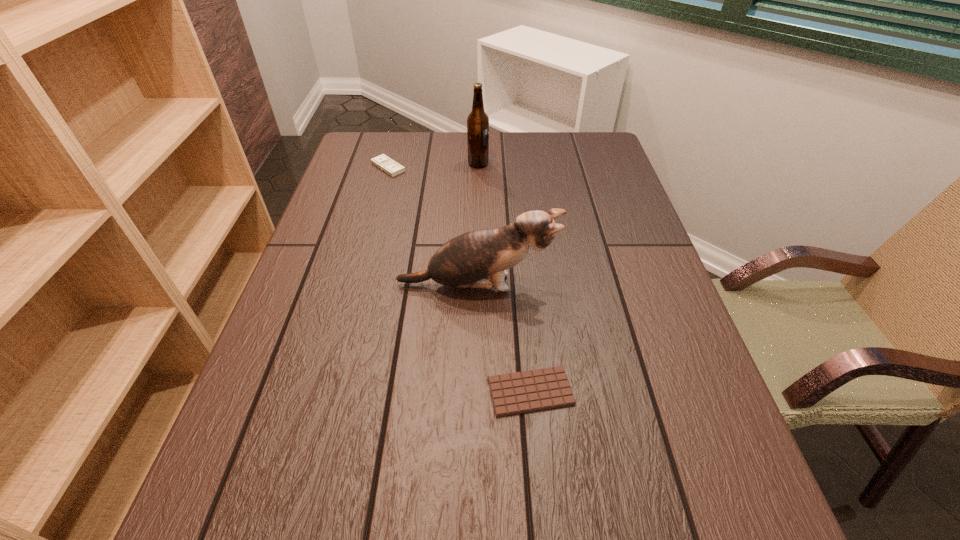
The height and width of the screenshot is (540, 960). Identify the location of free spot between the money and the third shortest object. (433, 226).

This screenshot has width=960, height=540. What are the coordinates of `free spot between the money and the beer bottle` in the screenshot? It's located at (433, 165).

Where is `free space between the second tallest object and the tallest object`? The height and width of the screenshot is (540, 960). free space between the second tallest object and the tallest object is located at coordinates [x=478, y=224].

Locate an element on the screen. vacant space in between the chocolate bar and the second tallest object is located at coordinates (504, 338).

Locate an element on the screen. free point between the leftmost object and the cat is located at coordinates (433, 226).

Find the location of a particular element. The image size is (960, 540). free space between the second shortest object and the cat is located at coordinates (433, 226).

This screenshot has height=540, width=960. I want to click on vacant space that is in between the beer bottle and the leftmost object, so click(x=433, y=165).

At what (x,y) coordinates should I click in order to perform the action: click on free spot between the nearest object and the third shortest object. Please return your answer as a coordinate pair (x, y). Image resolution: width=960 pixels, height=540 pixels. Looking at the image, I should click on (504, 338).

This screenshot has width=960, height=540. What are the coordinates of `free spot between the leftmost object and the beer bottle` in the screenshot? It's located at (433, 165).

Locate an element on the screen. Image resolution: width=960 pixels, height=540 pixels. object that is the closest to the second shortest object is located at coordinates pyautogui.click(x=477, y=121).